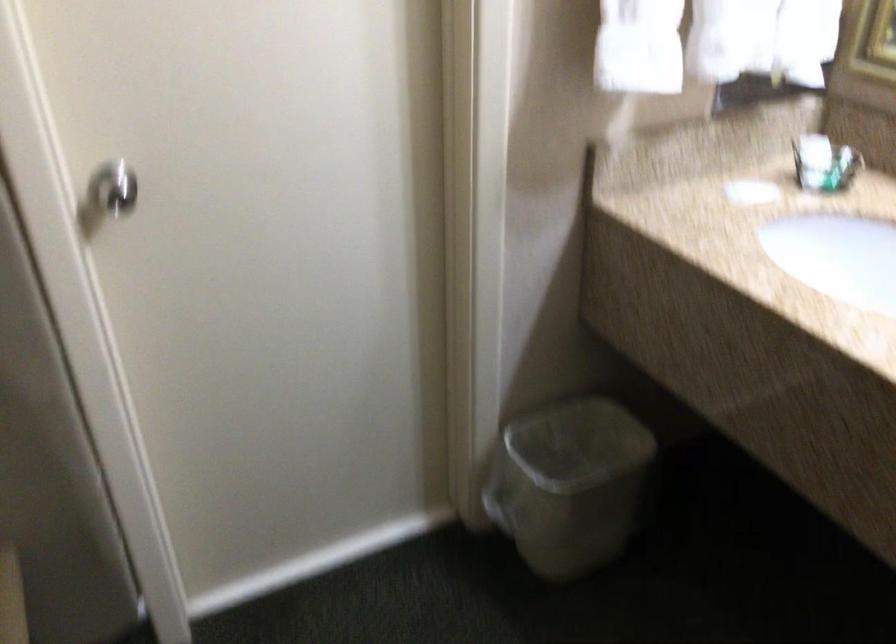
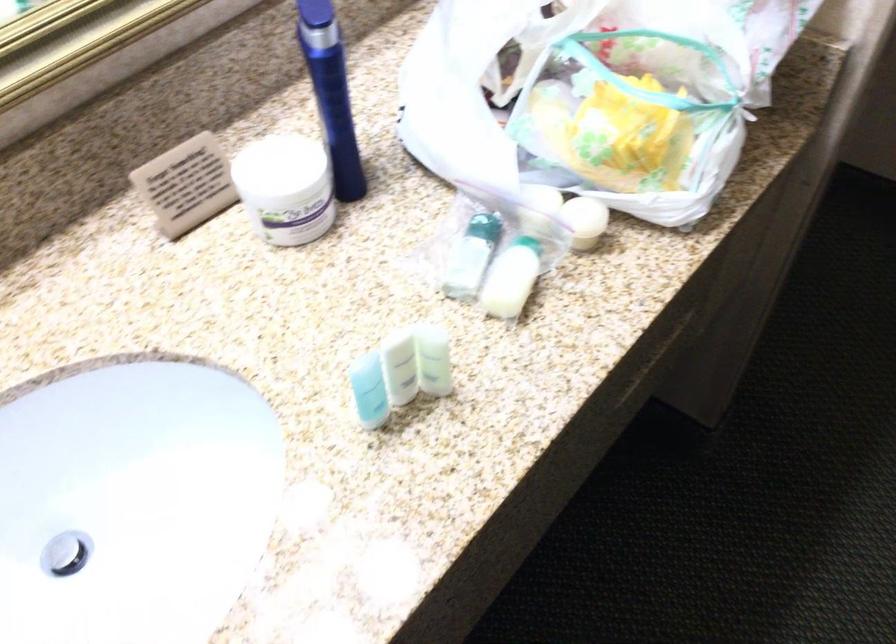
First-person continuous shooting, in which direction is the camera rotating?

The camera's rotation is toward right-down.